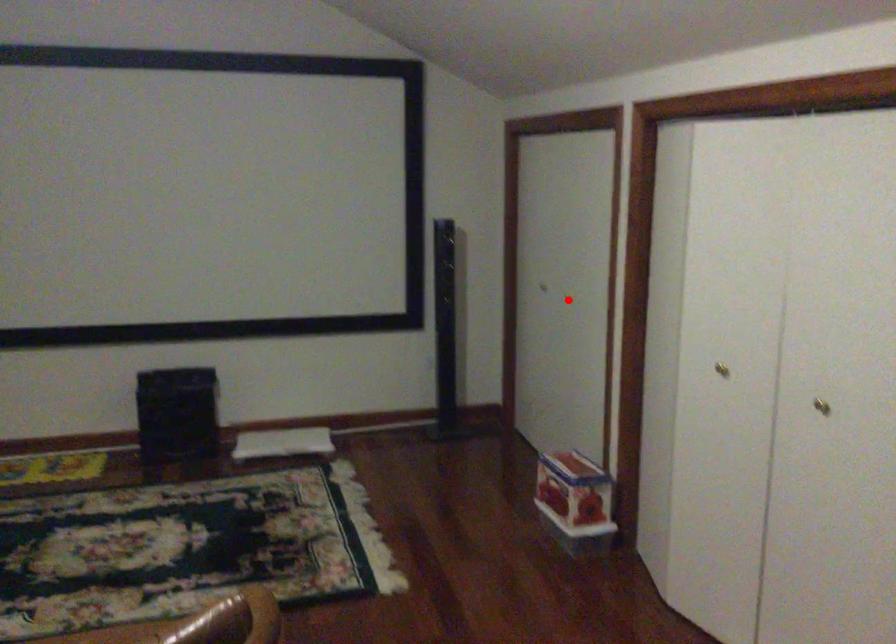
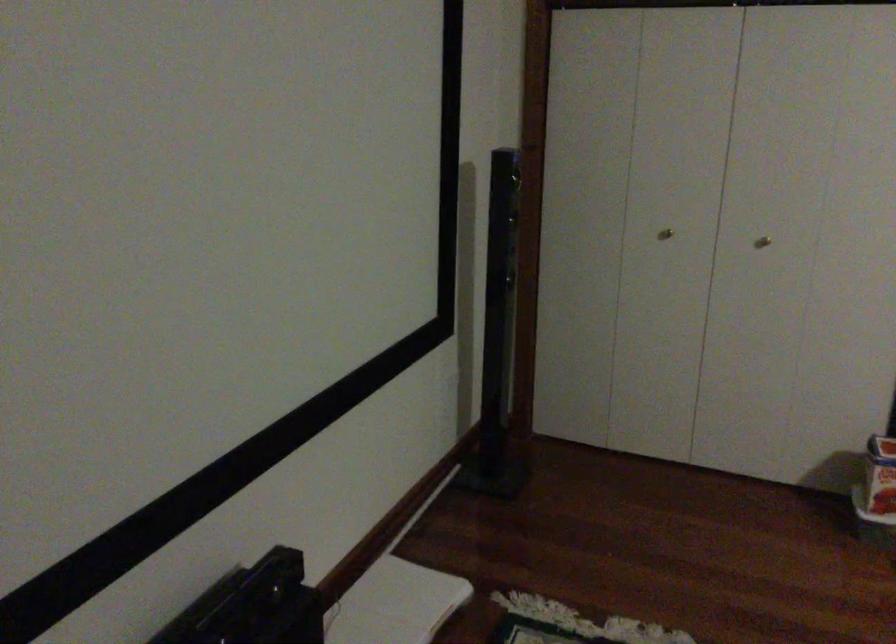
Find the pixel in the second image that matches the highlighted location in the first image.

(762, 242)